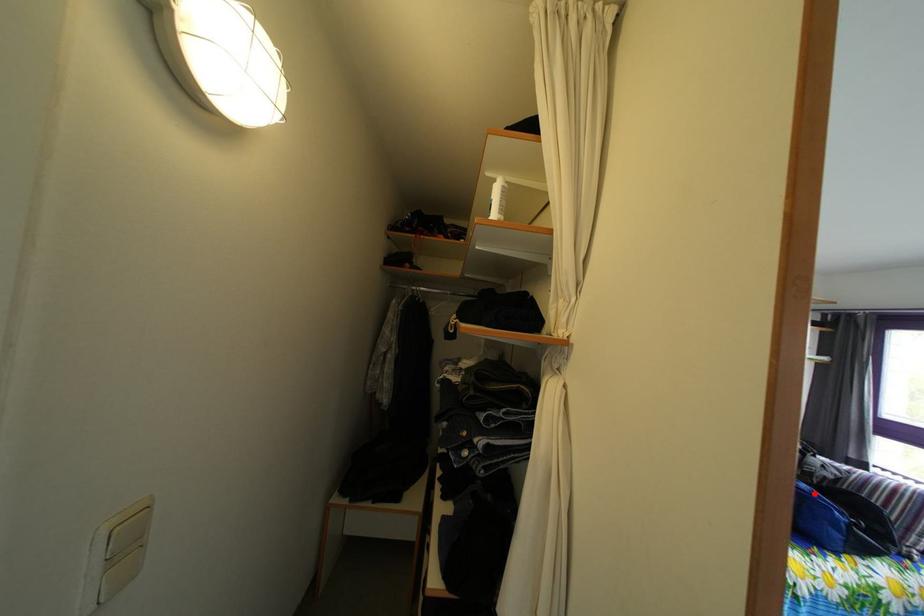
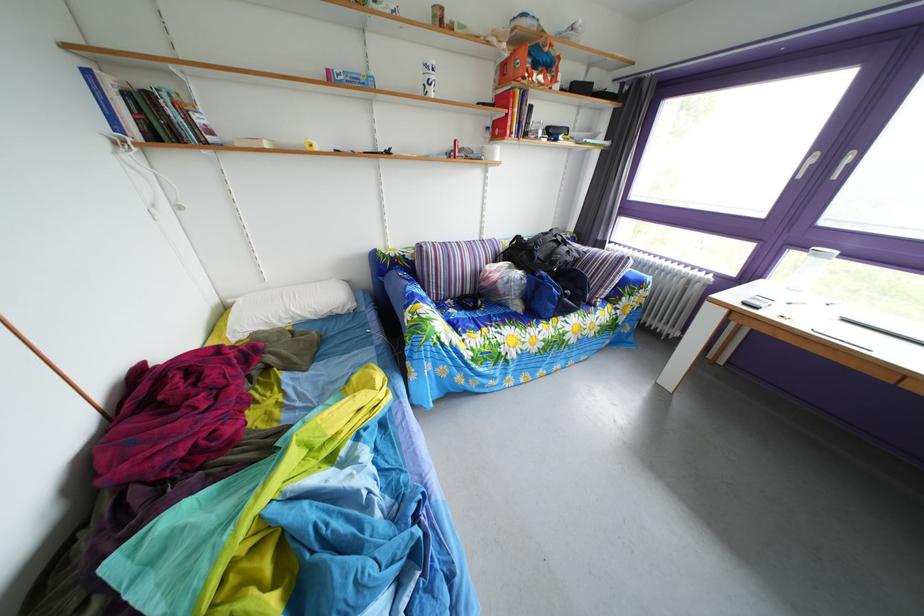
Question: A red point is marked in image1. In image2, is the corresponding 3D point closer to the camera or farther? Reply with the corresponding letter.

Choices:
 (A) The corresponding 3D point is closer.
 (B) The corresponding 3D point is farther.

Answer: (B)